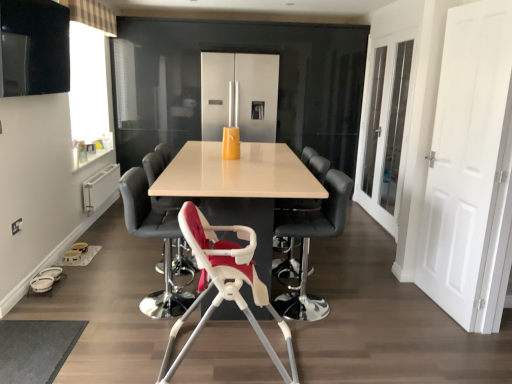
Question: Based on their sizes in the image, would you say black leather chair at center, the 5th chair in the front-to-back sequence, is bigger or smaller than white glass door at right?

Choices:
 (A) small
 (B) big

Answer: (A)

Question: From their relative heights in the image, would you say black leather chair at center, the 5th chair in the front-to-back sequence, is taller or shorter than white glass door at right?

Choices:
 (A) short
 (B) tall

Answer: (A)

Question: Estimate the real-world distances between objects in this image. Which object is farther from the matte white table at center?

Choices:
 (A) white plastic highchair at center, the fifth chair when ordered from back to front
 (B) white plastic highchair at center, positioned as the 2th chair in front-to-back order
 (C) black leather bar stool at center, which is the 3th chair from back to front
 (D) matte black chair at center, acting as the second chair starting from the back
 (E) white matte door at right

Answer: (E)

Question: Which object is the closest to the white plastic highchair at center, arranged as the fourth chair when viewed from the back?

Choices:
 (A) white glass door at right
 (B) white matte door at right
 (C) white plastic highchair at center, placed as the first chair when sorted from front to back
 (D) satin silver fridge at center
 (E) black leather bar stool at center, placed as the third chair when sorted from front to back

Answer: (C)